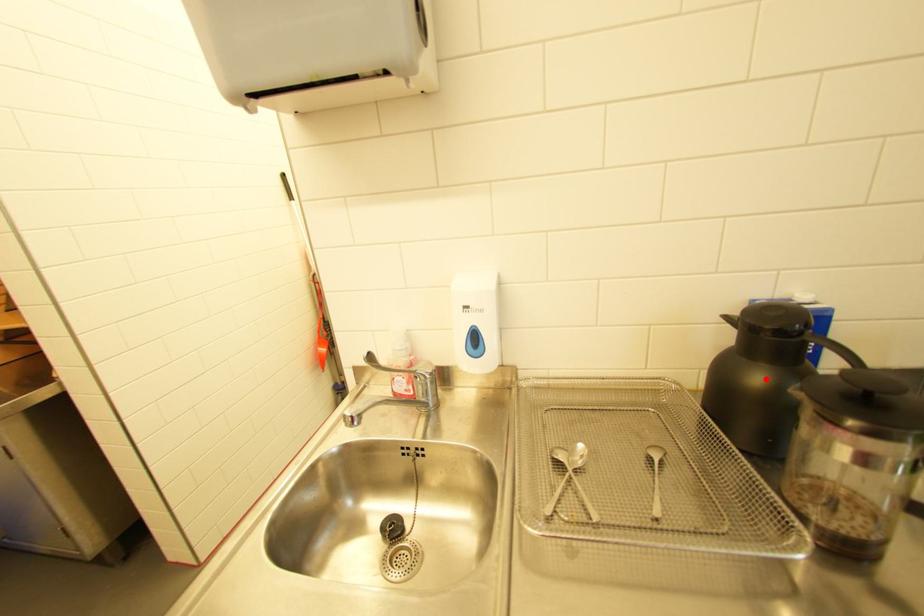
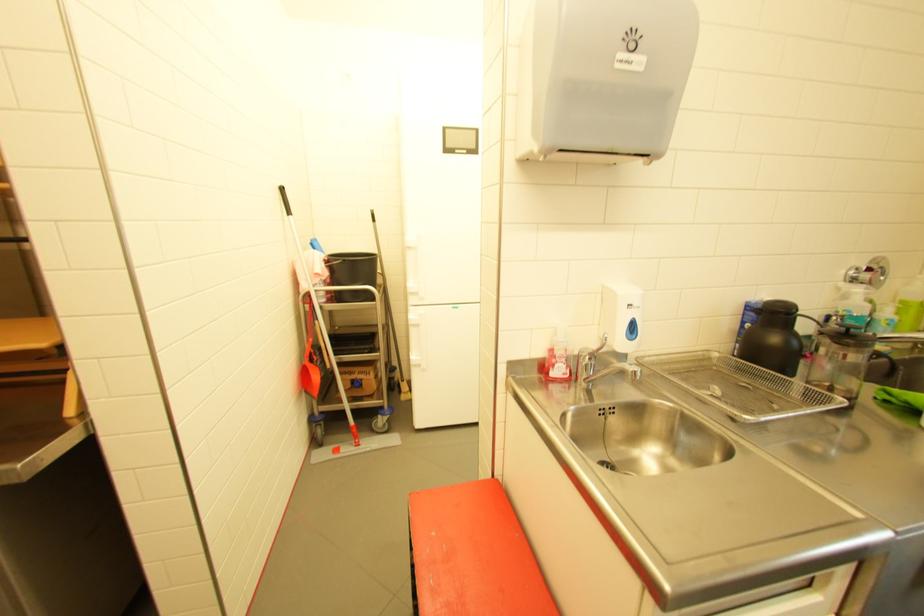
In the second image, find the point that corresponds to the highlighted location in the first image.

(782, 339)